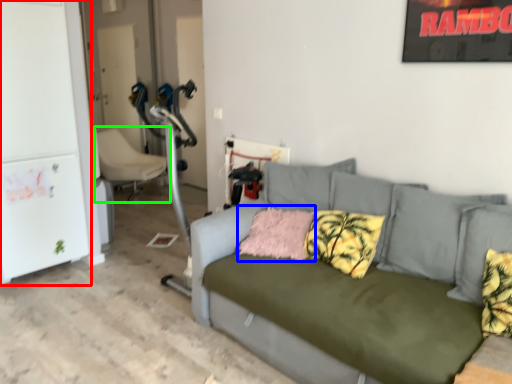
Question: Based on their relative distances, which object is farther from fridge (highlighted by a red box)? Choose from pillow (highlighted by a blue box) and chair (highlighted by a green box).

Choices:
 (A) pillow
 (B) chair

Answer: (A)